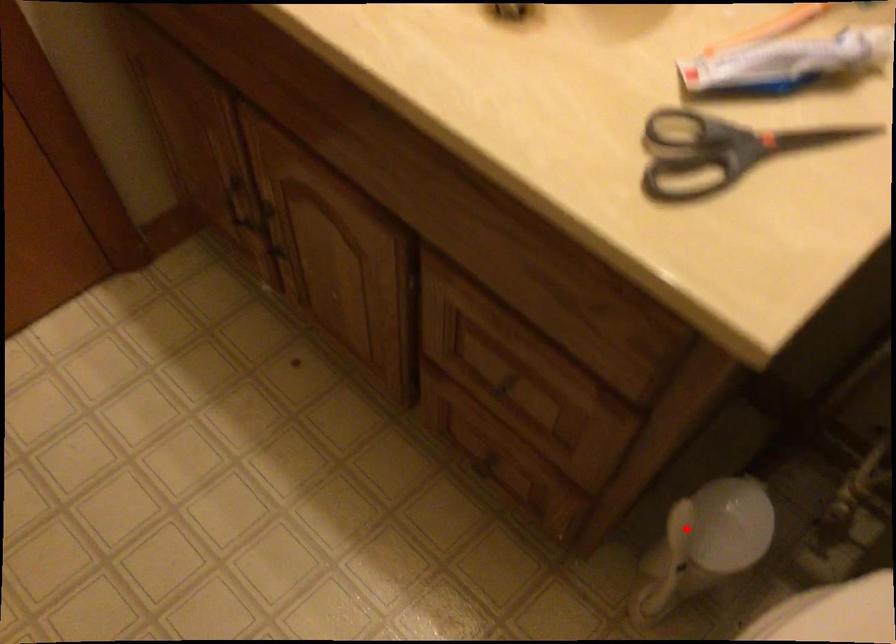
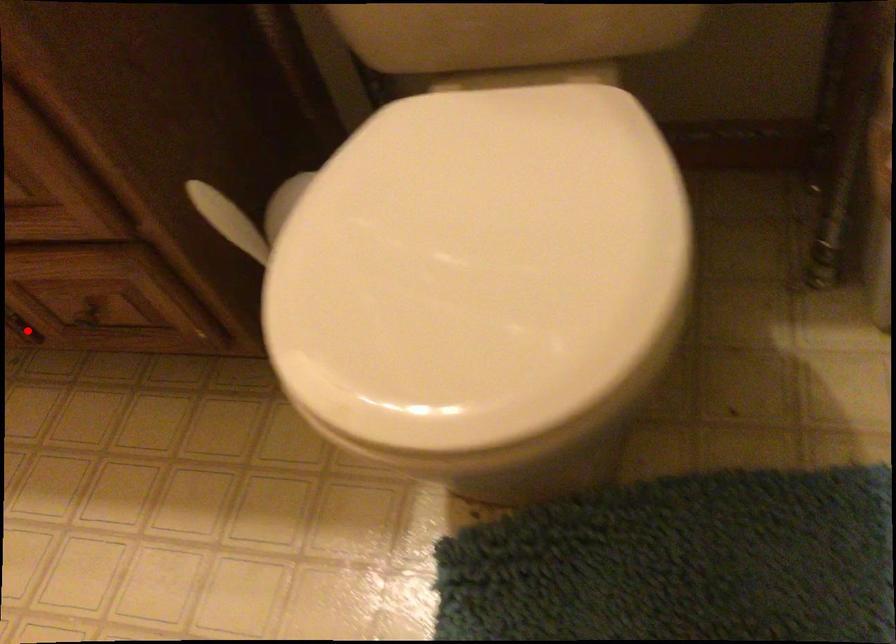
I am providing you with two images of the same scene from different viewpoints. A red point is marked on the first image and another point is marked on the second image. Is the marked point in image1 the same physical position as the marked point in image2?

No